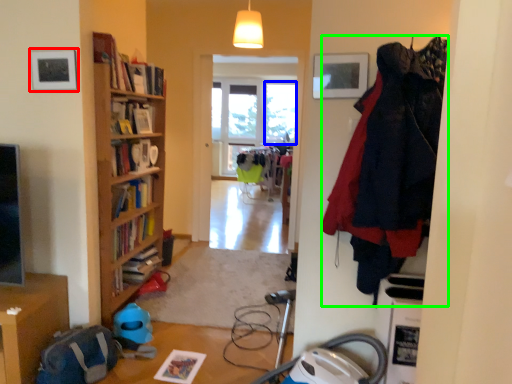
Question: Which object is the closest to the picture frame (highlighted by a red box)? Choose among these: window (highlighted by a blue box) or clothing (highlighted by a green box).

Choices:
 (A) window
 (B) clothing

Answer: (B)